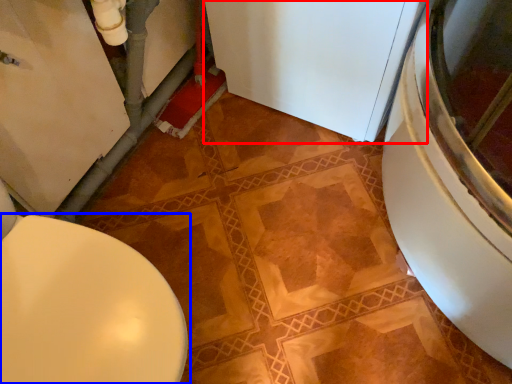
Question: Which object appears farthest to the camera in this image, appliance (highlighted by a red box) or toilet (highlighted by a blue box)?

Choices:
 (A) appliance
 (B) toilet

Answer: (A)